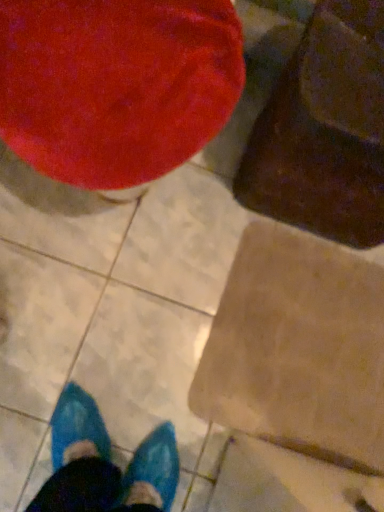
You are a GUI agent. You are given a task and a screenshot of the screen. Output one action in this format:
    pyautogui.click(x=<x>, y=<y>)
    Task: Click on the vacant area that is in front of velvet red bean bag chair at upper left, acting as the second bean bag chair starting from the right
    The height and width of the screenshot is (512, 384).
    Given the screenshot: What is the action you would take?
    pyautogui.click(x=87, y=317)